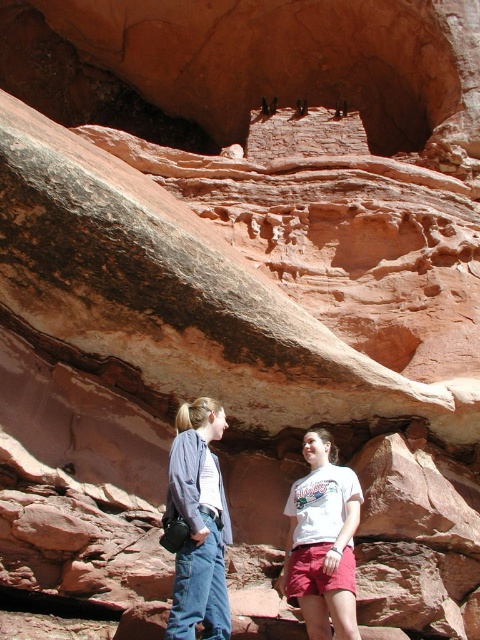
Question: Which of the following is the closest to the observer?

Choices:
 (A) (x=202, y=426)
 (B) (x=352, y=572)

Answer: (B)

Question: Which point appears closest to the camera in this image?

Choices:
 (A) (219, 582)
 (B) (226, 616)

Answer: (B)

Question: Is matte white t-shirt at center below denim jacket at lower left?

Choices:
 (A) no
 (B) yes

Answer: (B)

Question: Where is denim jacket at lower left located in relation to white cotton t-shirt at center in the image?

Choices:
 (A) above
 (B) below

Answer: (A)

Question: Is matte white t-shirt at center smaller than white cotton t-shirt at center?

Choices:
 (A) no
 (B) yes

Answer: (A)

Question: Which object appears closest to the camera in this image?

Choices:
 (A) matte white t-shirt at center
 (B) white cotton t-shirt at center

Answer: (A)